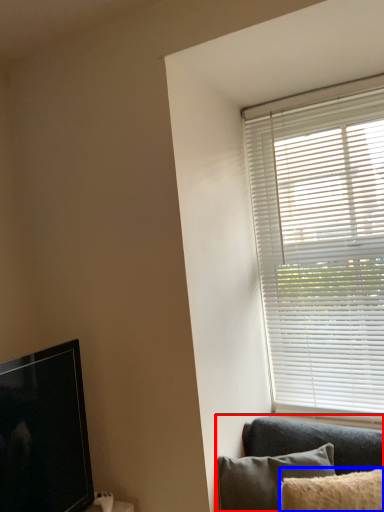
Question: Which of the following is the closest to the observer, studio couch (highlighted by a red box) or pillow (highlighted by a blue box)?

Choices:
 (A) studio couch
 (B) pillow

Answer: (B)